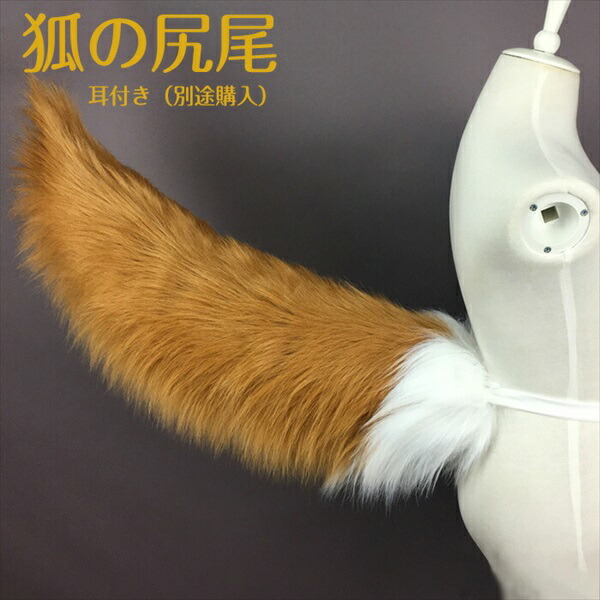
Find the location of `white fur`. white fur is located at coordinates (450, 400).